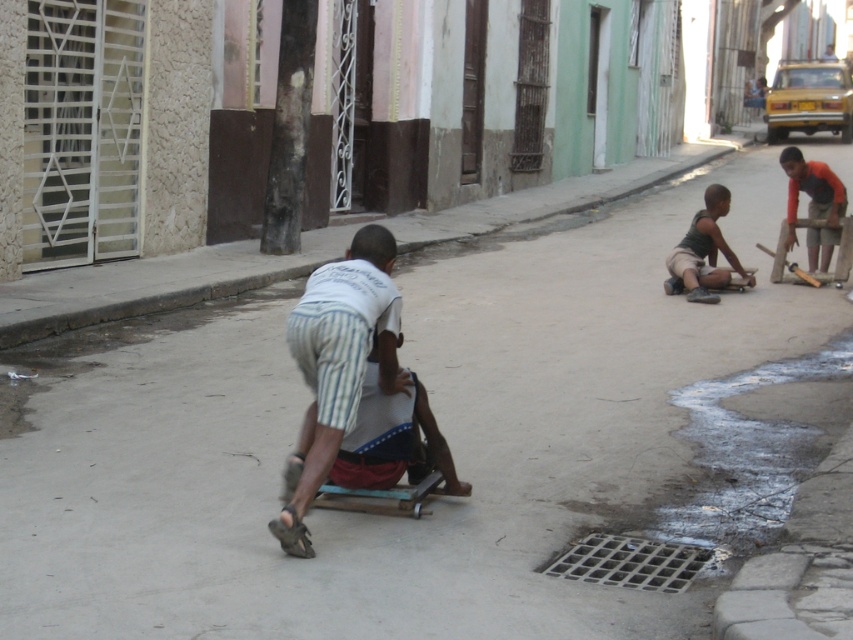
Which is behind, point (291, 472) or point (705, 193)?

Positioned behind is point (705, 193).

Looking at this image, can you confirm if striped cotton shorts at center is bigger than dark gray fabric shorts at right?

No.

Locate an element on the screen. striped cotton shorts at center is located at coordinates (337, 364).

Locate an element on the screen. This screenshot has width=853, height=640. striped cotton shorts at center is located at coordinates (337, 364).

Which is in front, point (724, 195) or point (824, 170)?

Point (724, 195)

Can you confirm if dark gray fabric shorts at right is wider than orange cotton shirt at right?

Yes.

Measure the distance between dark gray fabric shorts at right and camera.

dark gray fabric shorts at right is 12.79 meters away from camera.

The image size is (853, 640). What are the coordinates of `dark gray fabric shorts at right` in the screenshot? It's located at (703, 252).

Is striped cotton shorts at center closer to the viewer compared to orange cotton shirt at right?

Yes, it is.

Who is taller, striped cotton shorts at center or orange cotton shirt at right?

striped cotton shorts at center

Where is `striped cotton shorts at center`? striped cotton shorts at center is located at coordinates tap(337, 364).